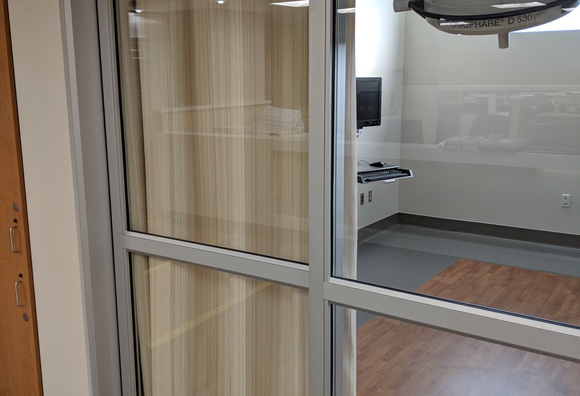
Find the location of a particular element. The height and width of the screenshot is (396, 580). computer station is located at coordinates pyautogui.click(x=365, y=103), pyautogui.click(x=379, y=161), pyautogui.click(x=373, y=179).